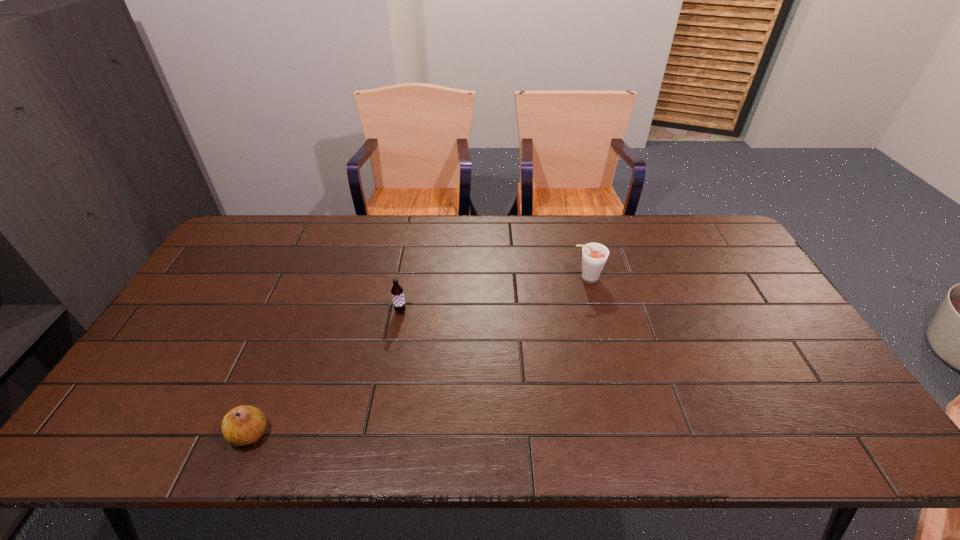
The width and height of the screenshot is (960, 540). What are the coordinates of `vacant area that satisfies the following two spatial constraints: 1. on the back side of the left root beer; 2. on the left side of the leftmost object` in the screenshot? It's located at (300, 311).

The image size is (960, 540). What are the coordinates of `vacant space that satisfies the following two spatial constraints: 1. on the back side of the nearer root beer; 2. on the right side of the leftmost object` in the screenshot? It's located at (300, 311).

This screenshot has width=960, height=540. Identify the location of free spot that satisfies the following two spatial constraints: 1. on the back side of the left root beer; 2. on the left side of the pear. (300, 311).